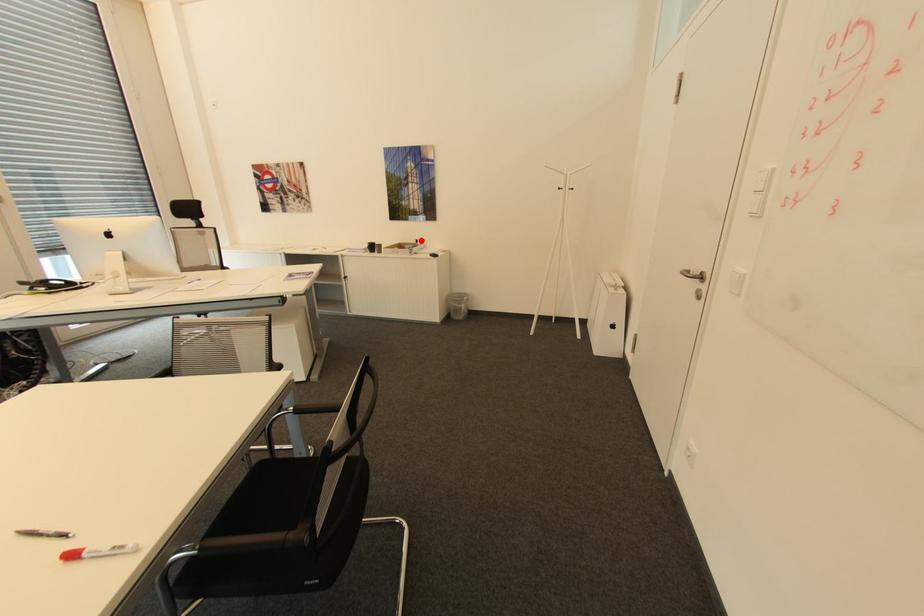
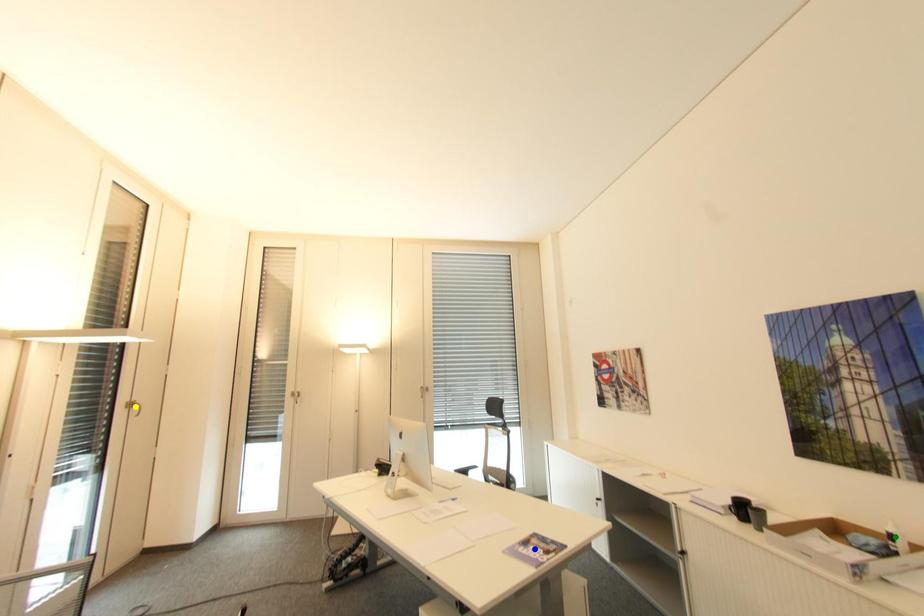
Question: I am providing you with two images of the same scene from different viewpoints. A red point is marked on the first image. You are given multiple points on the second image. In image 2, which mark is for the same physical point as the one in image 1?

Choices:
 (A) green point
 (B) yellow point
 (C) blue point

Answer: (A)